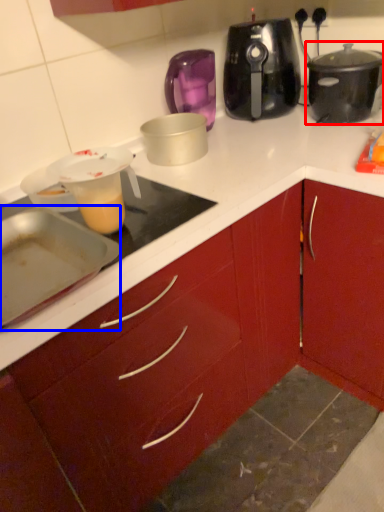
Question: Which object appears farthest to the camera in this image, slow cooker (highlighted by a red box) or kitchen appliance (highlighted by a blue box)?

Choices:
 (A) slow cooker
 (B) kitchen appliance

Answer: (A)